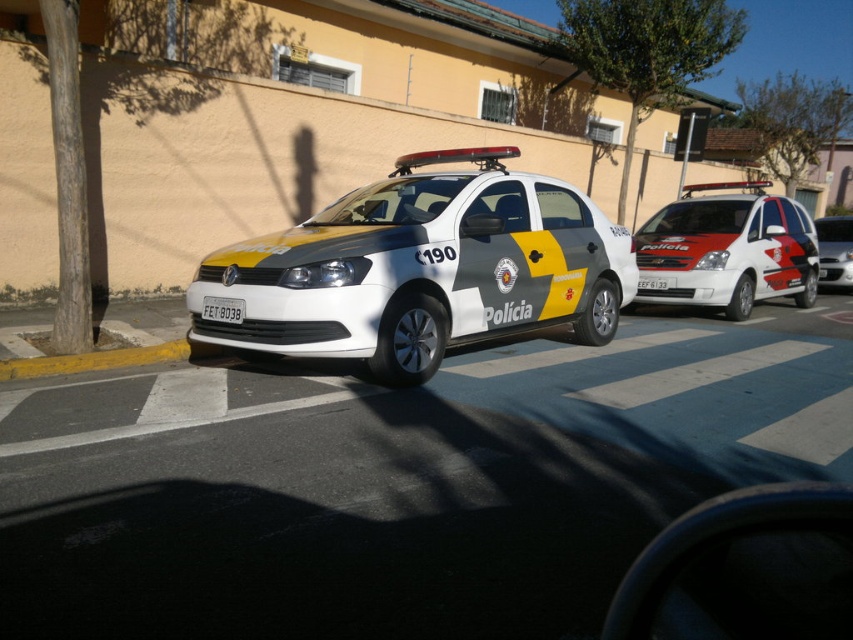
Question: Which is farther from the white glossy van at right?

Choices:
 (A) white plastic license plate at center
 (B) white glossy police car at center

Answer: (A)

Question: Is white glossy van at right closer to the viewer compared to white plastic license plate at center?

Choices:
 (A) no
 (B) yes

Answer: (A)

Question: Does white glossy van at right have a lesser width compared to white plastic license plate at center?

Choices:
 (A) no
 (B) yes

Answer: (A)

Question: Which of the following is the closest to the observer?

Choices:
 (A) (581, 220)
 (B) (740, 284)
 (C) (221, 310)
 (D) (824, 284)

Answer: (C)

Question: Is white glossy police car at center thinner than white glossy van at right?

Choices:
 (A) no
 (B) yes

Answer: (A)

Question: Which point is closer to the camera taking this photo?

Choices:
 (A) (239, 321)
 (B) (337, 300)
 (C) (819, 278)
 (D) (741, 240)

Answer: (B)